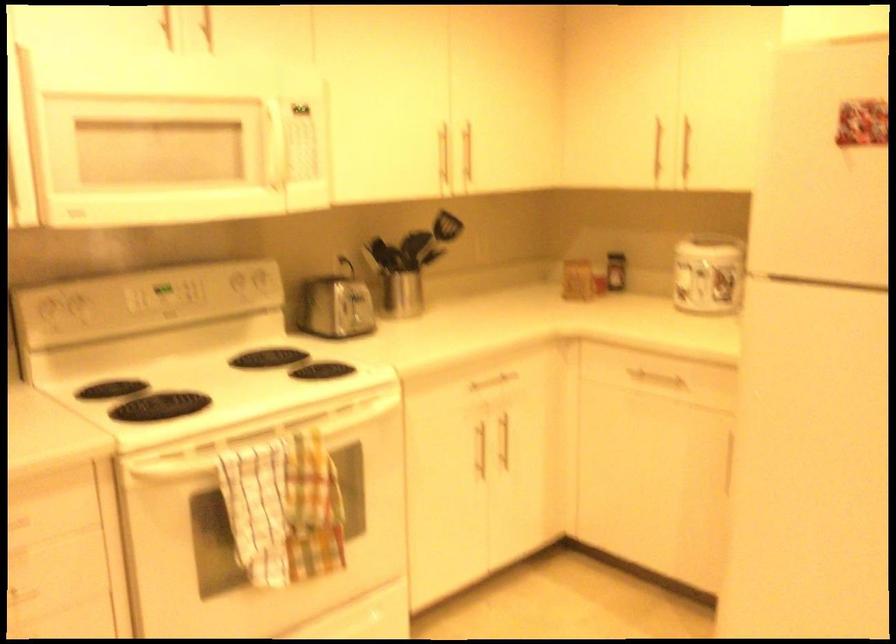
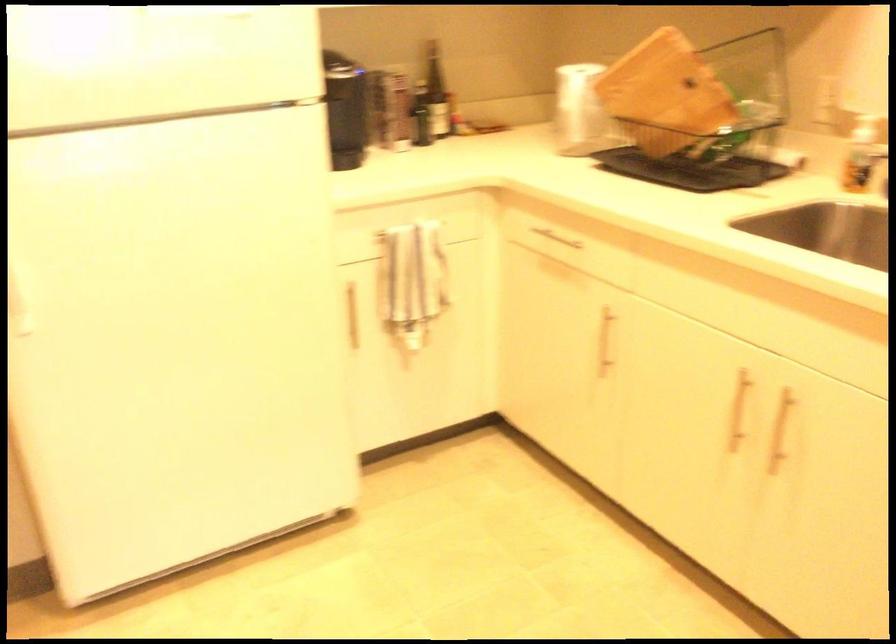
How did the camera likely rotate?

The rotation direction of the camera is right-down.